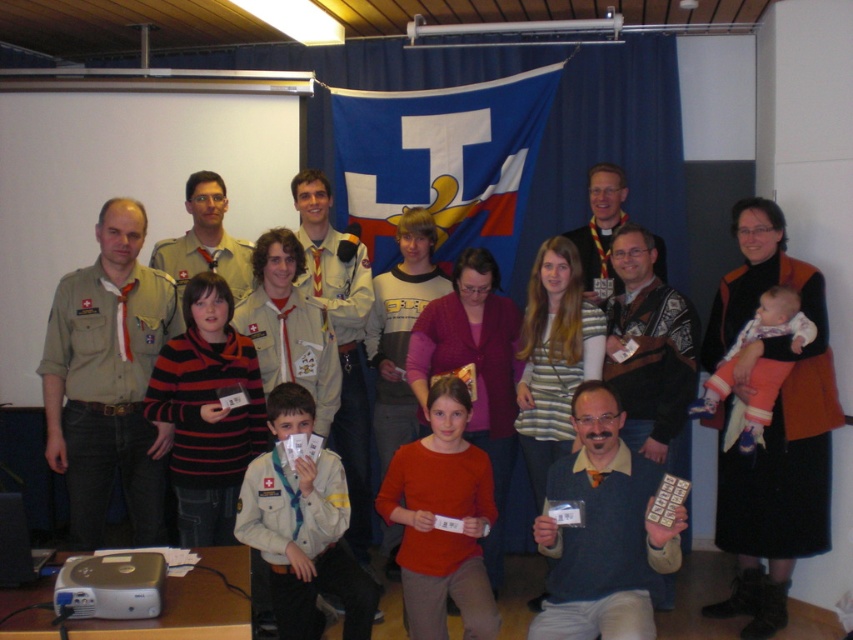
Between point (416, 157) and point (694, 406), which one is positioned in front?

Point (694, 406) is in front.

Can you confirm if blue fabric flag at center is bigger than soft pink fabric baby at right?

Yes.

Between point (502, 120) and point (804, 336), which one is positioned in front?

Point (804, 336) is more forward.

Locate an element on the screen. blue fabric flag at center is located at coordinates (440, 161).

Which is above, blue fabric flag at center or white matte uniform at center?

blue fabric flag at center is higher up.

Who is more forward, [497,97] or [283,604]?

Positioned in front is point [283,604].

This screenshot has width=853, height=640. Find the location of `blue fabric flag at center`. blue fabric flag at center is located at coordinates 440,161.

Can you confirm if white matte uniform at center is positioned to the right of soft pink fabric baby at right?

In fact, white matte uniform at center is to the left of soft pink fabric baby at right.

I want to click on white matte uniform at center, so click(305, 541).

Is point (311, 573) closer to viewer compared to point (753, 412)?

Yes.

Locate an element on the screen. white matte uniform at center is located at coordinates (305, 541).